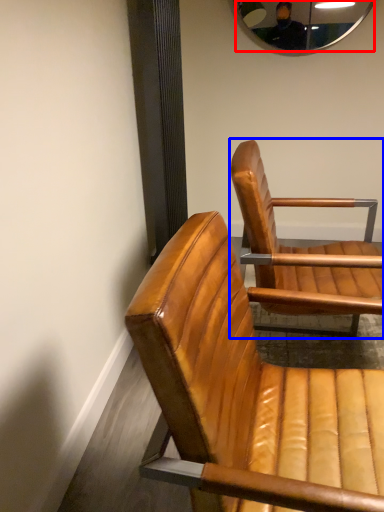
Question: Which point is further to the camera, mirror (highlighted by a red box) or chair (highlighted by a blue box)?

Choices:
 (A) mirror
 (B) chair

Answer: (A)